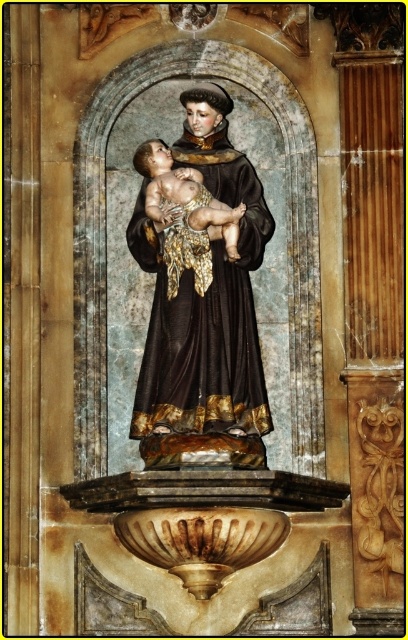
Question: Does shiny dark brown fabric at center appear on the right side of smooth gold cloth at center?

Choices:
 (A) no
 (B) yes

Answer: (B)

Question: Can you confirm if shiny dark brown fabric at center is bigger than smooth gold cloth at center?

Choices:
 (A) no
 (B) yes

Answer: (B)

Question: Can you confirm if shiny dark brown fabric at center is positioned to the right of smooth gold cloth at center?

Choices:
 (A) yes
 (B) no

Answer: (A)

Question: Which of the following is the closest to the observer?

Choices:
 (A) shiny dark brown fabric at center
 (B) smooth gold cloth at center

Answer: (A)

Question: Among these points, which one is farthest from the camera?

Choices:
 (A) (186, 212)
 (B) (148, 225)

Answer: (B)